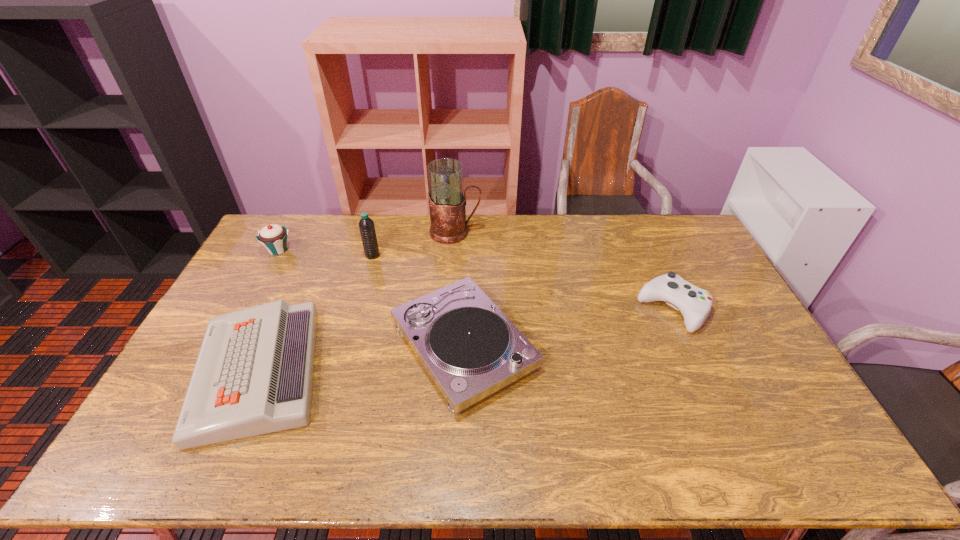
Where is `object that stands as the closest to the rightmost object`? Image resolution: width=960 pixels, height=540 pixels. object that stands as the closest to the rightmost object is located at coordinates coord(470,349).

This screenshot has width=960, height=540. Identify the location of the closest object relative to the fourth shortest object. (254, 373).

This screenshot has height=540, width=960. I want to click on free space that satisfies the following two spatial constraints: 1. with the handle on the side of the pitcher; 2. on the front side of the computer keyboard, so click(445, 371).

Image resolution: width=960 pixels, height=540 pixels. I want to click on free space that satisfies the following two spatial constraints: 1. with the handle on the side of the pitcher; 2. on the right side of the record player, so tap(447, 346).

Image resolution: width=960 pixels, height=540 pixels. In order to click on vacant point that satisfies the following two spatial constraints: 1. with the handle on the side of the record player; 2. on the left side of the pitcher in this screenshot , I will do `click(447, 346)`.

What are the coordinates of `vacant region that satisfies the following two spatial constraints: 1. with the handle on the side of the tallest object; 2. on the right side of the record player` in the screenshot? It's located at (447, 346).